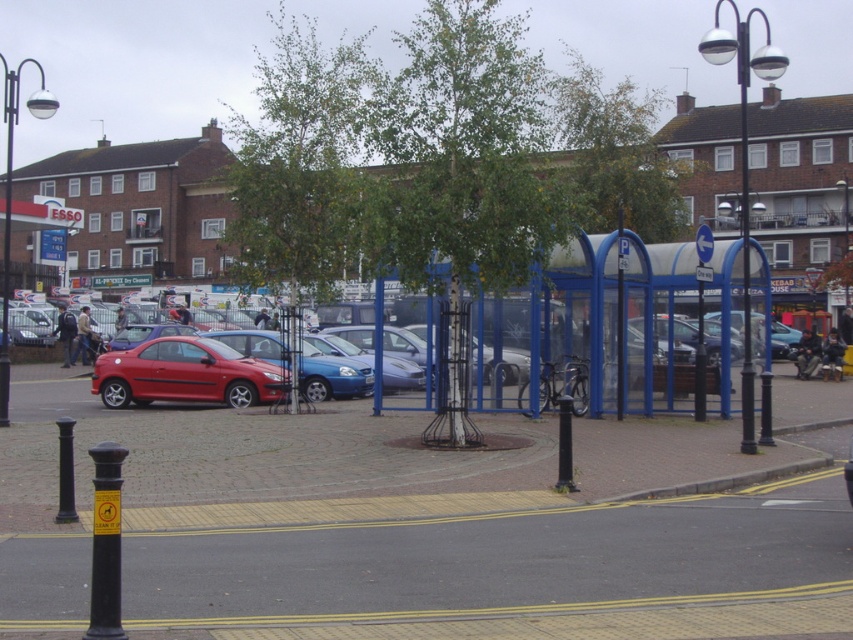
You are a city planner assessing the lighting in the area. The metallic silver streetlight at right and the matte black lamp post at left are both present. Which one is taller?

The metallic silver streetlight at right is taller than the matte black lamp post at left according to the description.